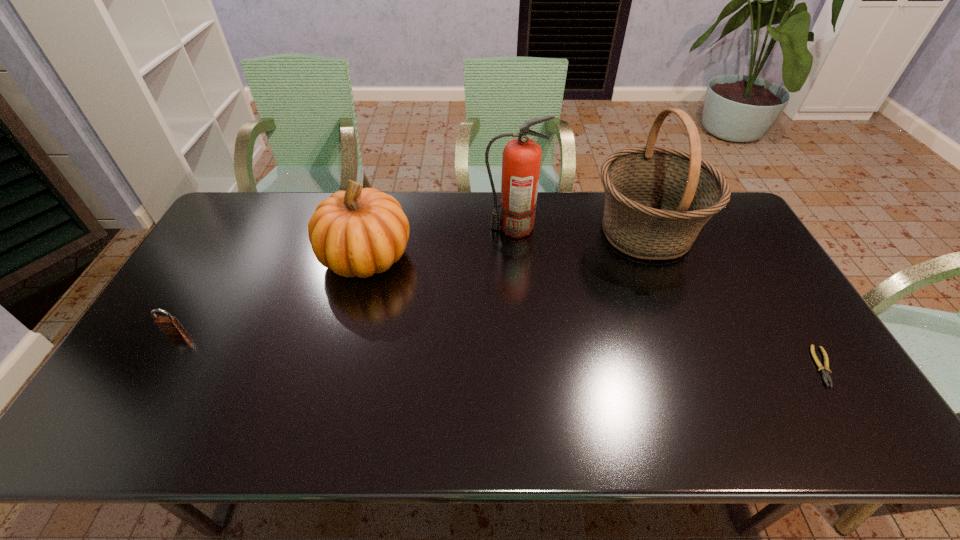
I want to click on blank space that satisfies the following two spatial constraints: 1. on the nozzle of the third object from right to left; 2. on the front side of the fourth object from right to left, so click(x=516, y=256).

Identify the location of vacant area in the image that satisfies the following two spatial constraints: 1. on the front-facing side of the padlock; 2. on the left side of the pliers. (154, 367).

You are a GUI agent. You are given a task and a screenshot of the screen. Output one action in this format:
    pyautogui.click(x=<x>, y=<y>)
    Task: Click on the vacant position in the image that satisfies the following two spatial constraints: 1. on the nozzle of the third object from right to left; 2. on the left side of the basket
    The height and width of the screenshot is (540, 960).
    Given the screenshot: What is the action you would take?
    pyautogui.click(x=514, y=232)

Where is `vacant area that satisfies the following two spatial constraints: 1. on the nozzle of the rightmost object; 2. on the left side of the third object from right to left`? This screenshot has width=960, height=540. vacant area that satisfies the following two spatial constraints: 1. on the nozzle of the rightmost object; 2. on the left side of the third object from right to left is located at coordinates [x=524, y=367].